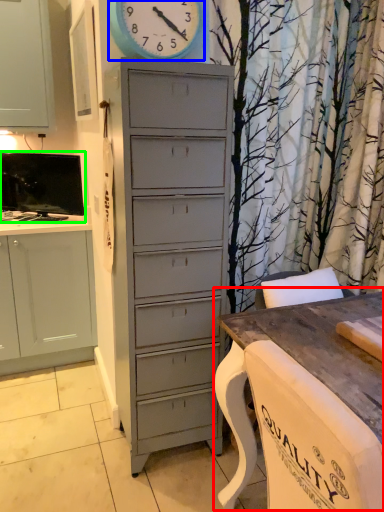
Question: Estimate the real-world distances between objects in this image. Which object is farther from table (highlighted by a red box), clock (highlighted by a blue box) or television (highlighted by a green box)?

Choices:
 (A) clock
 (B) television

Answer: (B)